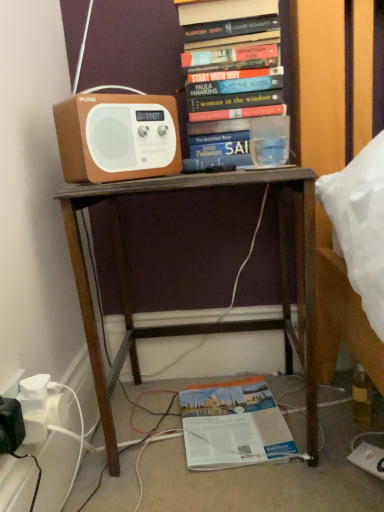
Question: Is brown matte speaker at upper left not near orange paper book at lower center, the 2th book from the top?

Choices:
 (A) no
 (B) yes

Answer: (A)

Question: Can you confirm if brown matte speaker at upper left is smaller than orange paper book at lower center, the 2th book from the top?

Choices:
 (A) yes
 (B) no

Answer: (A)

Question: Does brown matte speaker at upper left have a lesser height compared to orange paper book at lower center, which appears as the 1th book when ordered from the bottom?

Choices:
 (A) yes
 (B) no

Answer: (B)

Question: Can orange paper book at lower center, the 2th book from the top, be found inside brown matte speaker at upper left?

Choices:
 (A) yes
 (B) no

Answer: (B)

Question: Is brown matte speaker at upper left aimed at orange paper book at lower center, which appears as the 1th book when ordered from the bottom?

Choices:
 (A) no
 (B) yes

Answer: (A)

Question: From a real-world perspective, is brown wooden desk at center physically located above or below brown matte speaker at upper left?

Choices:
 (A) below
 (B) above

Answer: (A)

Question: From their relative heights in the image, would you say brown wooden desk at center is taller or shorter than brown matte speaker at upper left?

Choices:
 (A) short
 (B) tall

Answer: (B)

Question: Is brown wooden desk at center to the left or to the right of brown matte speaker at upper left in the image?

Choices:
 (A) right
 (B) left

Answer: (A)

Question: Is brown wooden desk at center in front of or behind brown matte speaker at upper left in the image?

Choices:
 (A) front
 (B) behind

Answer: (A)

Question: In terms of size, does orange paper book at lower center, the 2th book from the top, appear bigger or smaller than hardcover books at upper center, placed as the second book when sorted from bottom to top?

Choices:
 (A) big
 (B) small

Answer: (B)

Question: Which is correct: orange paper book at lower center, the 2th book from the top, is inside hardcover books at upper center, positioned as the 1th book in top-to-bottom order, or outside of it?

Choices:
 (A) inside
 (B) outside

Answer: (B)

Question: From a real-world perspective, relative to hardcover books at upper center, positioned as the 1th book in top-to-bottom order, is orange paper book at lower center, which appears as the 1th book when ordered from the bottom, vertically above or below?

Choices:
 (A) above
 (B) below

Answer: (B)

Question: Is point (x=182, y=408) closer or farther from the camera than point (x=200, y=29)?

Choices:
 (A) closer
 (B) farther

Answer: (B)

Question: Considering the positions of brown matte speaker at upper left and orange paper book at lower center, the 2th book from the top, in the image, is brown matte speaker at upper left bigger or smaller than orange paper book at lower center, the 2th book from the top,?

Choices:
 (A) big
 (B) small

Answer: (B)

Question: Relative to orange paper book at lower center, which appears as the 1th book when ordered from the bottom, is brown matte speaker at upper left in front or behind?

Choices:
 (A) behind
 (B) front

Answer: (B)